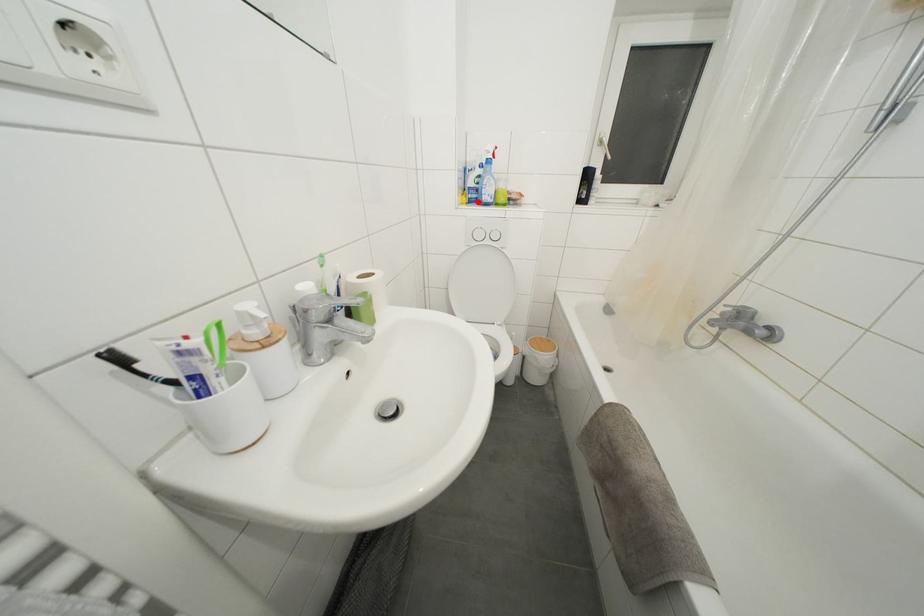
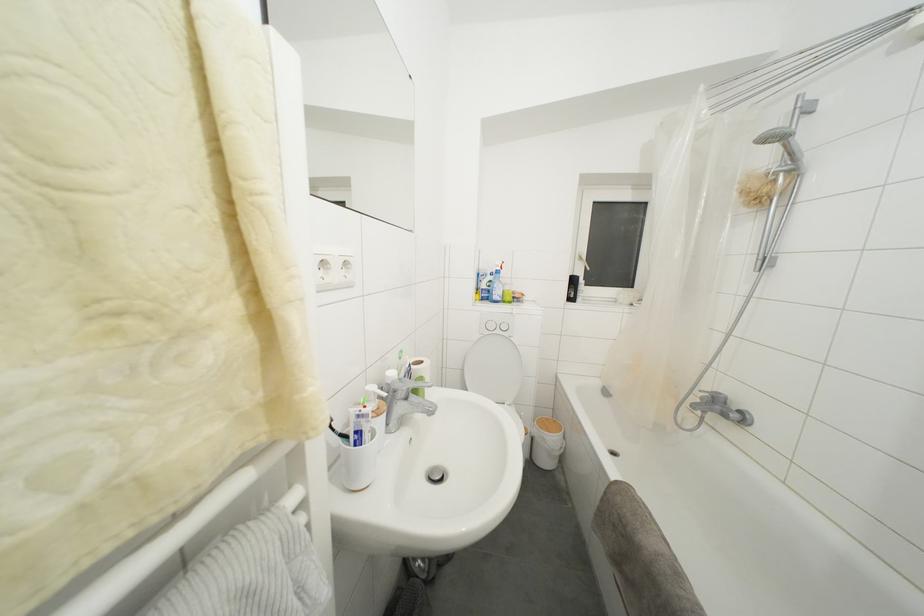
Locate, in the second image, the point that corresponds to the highlighted location in the first image.

(490, 301)